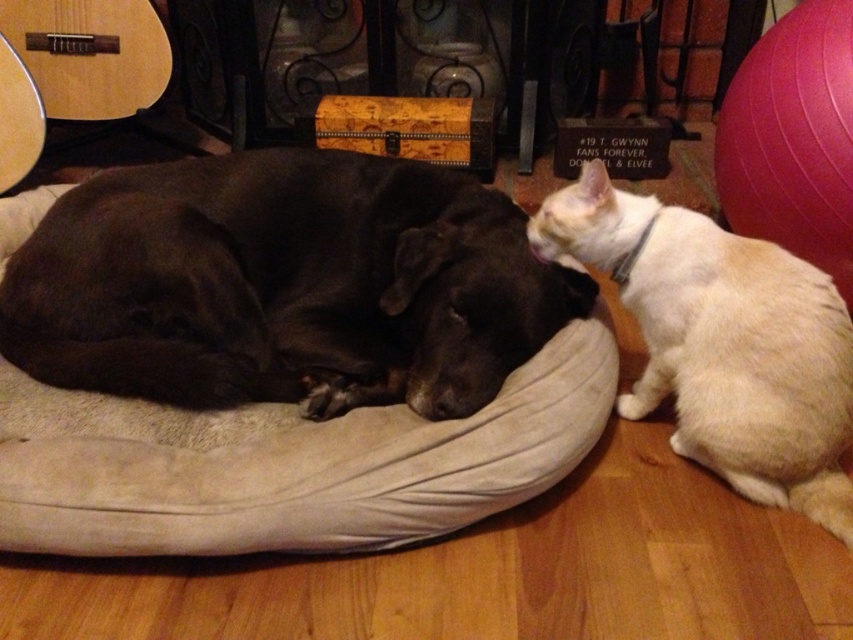
You are a toy mouse that is 10 cm long. You want to move from the shiny black dog at center to the white fur cat at right. Can you fit through the space between them?

The shiny black dog at center is larger in size than the white fur cat at right, but the exact distance between them isn not specified. Therefore, it is uncertain if the toy mouse can fit through the space between them.

You are a small toy mouse that is 0.2 meters long. You want to move from the shiny black dog at center to the decorative black metal piece in the background. Can you fit through the space between them?

The distance between the shiny black dog at center and the decorative black metal piece in the background is 1.30 meters, so yes, the toy mouse can fit through the space between them since it is wider than the mouse.

From the picture: You are a toy mouse that is 10 cm tall. You want to play with the shiny black dog at center and the white fur cat at right. Which animal can you reach over without jumping?

The shiny black dog at center is shorter than the white fur cat at right, so the toy mouse can reach over the shiny black dog at center without jumping but would need to jump to reach over the white fur cat at right.